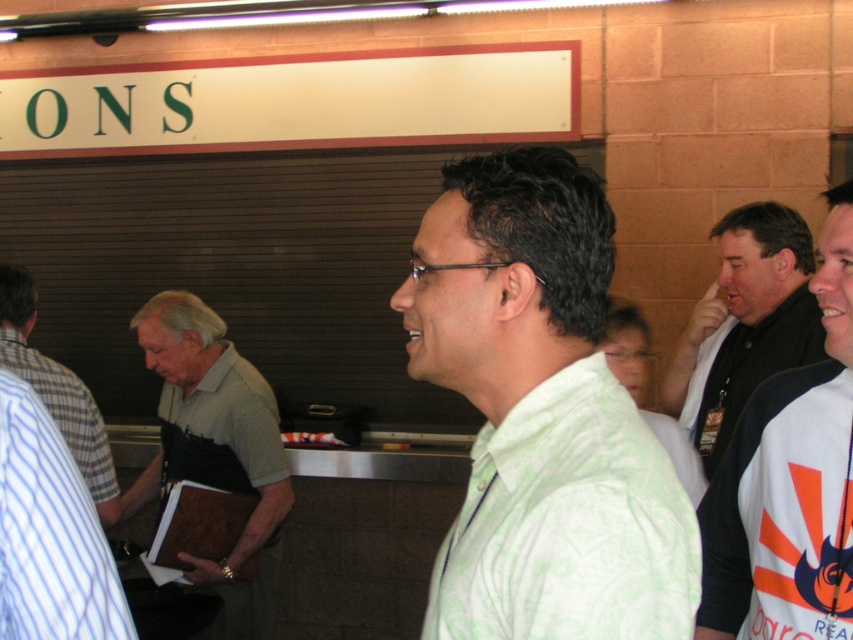
You are an airport staff member checking the clothing of two people at the left side of the baggage claim area. Which shirt is lower in position between the gray fabric shirt at left and the striped cotton shirt at left?

The gray fabric shirt at left is positioned under the striped cotton shirt at left, so the gray fabric shirt at left is lower.

You are a traveler looking for your luggage at the airport. You notice two people nearby wearing a white jersey at right and a gray fabric shirt at left. According to the scene, which person is blocking your view of the conveyor belt behind them?

The white jersey at right is positioned over gray fabric shirt at left, so the white jersey at right is blocking the view of the conveyor belt.

You are standing in the baggage claim area and see two people in front of you. One is wearing a gray fabric shirt at left and the other a white jersey at right. Based on their positions, which person is closer to the conveyor belt?

The gray fabric shirt at left is closer to the conveyor belt because the white jersey at right is positioned to its right, meaning the gray fabric shirt at left is nearer to the conveyor belt area.